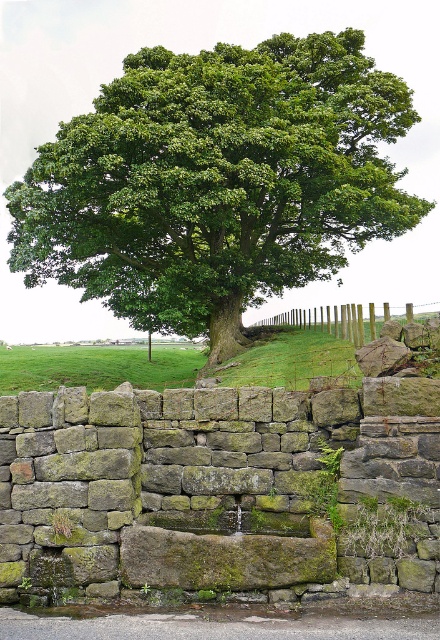
You are standing in the rural landscape and want to take a photo of the wooden posts at center without the green leafy tree at upper center blocking the view. Is this possible given their positions?

The wooden posts at center is behind the green leafy tree at upper center, so you cannot take a photo of the wooden posts at center without the tree blocking the view.

You are planning to install a new pathway between the green mossy stone at center and the wooden posts at center. The pathway requires a minimum of 10 feet of space. Based on the scene, will the available space between them accommodate the pathway?

The distance between the green mossy stone at center and the wooden posts at center is 13.82 feet, which is greater than the required 10 feet. Therefore, the pathway can be installed between them.